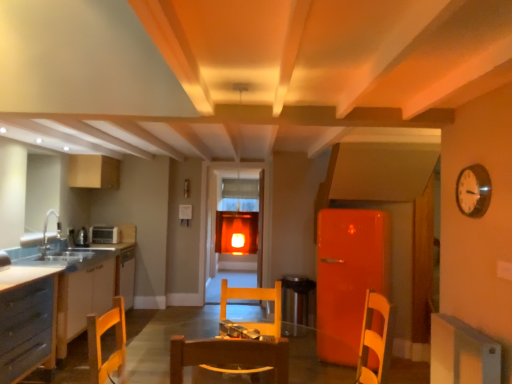
Question: Does wooden round table at center have a larger size compared to wooden chair at center?

Choices:
 (A) no
 (B) yes

Answer: (B)

Question: Is wooden round table at center looking in the opposite direction of wooden chair at center?

Choices:
 (A) yes
 (B) no

Answer: (B)

Question: Can we say wooden round table at center lies outside wooden chair at center?

Choices:
 (A) yes
 (B) no

Answer: (A)

Question: Can you confirm if wooden round table at center is shorter than wooden chair at center?

Choices:
 (A) yes
 (B) no

Answer: (B)

Question: Can you confirm if wooden round table at center is wider than wooden chair at center?

Choices:
 (A) no
 (B) yes

Answer: (A)

Question: Considering the positions of point pos(95,269) and point pos(475,182), is point pos(95,269) closer or farther from the camera than point pos(475,182)?

Choices:
 (A) closer
 (B) farther

Answer: (B)

Question: From the image's perspective, is white glossy countertop at left above or below white glossy clock at upper right?

Choices:
 (A) below
 (B) above

Answer: (A)

Question: In terms of size, does white glossy countertop at left appear bigger or smaller than white glossy clock at upper right?

Choices:
 (A) big
 (B) small

Answer: (A)

Question: Visually, is white glossy countertop at left positioned to the left or to the right of white glossy clock at upper right?

Choices:
 (A) left
 (B) right

Answer: (A)

Question: In terms of width, does white glossy clock at upper right look wider or thinner when compared to transparent glass door at center?

Choices:
 (A) thin
 (B) wide

Answer: (A)

Question: Considering the positions of white glossy clock at upper right and transparent glass door at center in the image, is white glossy clock at upper right taller or shorter than transparent glass door at center?

Choices:
 (A) short
 (B) tall

Answer: (A)

Question: Relative to transparent glass door at center, is white glossy clock at upper right in front or behind?

Choices:
 (A) front
 (B) behind

Answer: (A)

Question: Considering the relative positions of white glossy clock at upper right and transparent glass door at center in the image provided, is white glossy clock at upper right to the left or to the right of transparent glass door at center?

Choices:
 (A) left
 (B) right

Answer: (B)

Question: In the image, is wooden round table at center on the left side or the right side of transparent glass door at center?

Choices:
 (A) left
 (B) right

Answer: (B)

Question: In terms of height, does wooden round table at center look taller or shorter compared to transparent glass door at center?

Choices:
 (A) tall
 (B) short

Answer: (B)